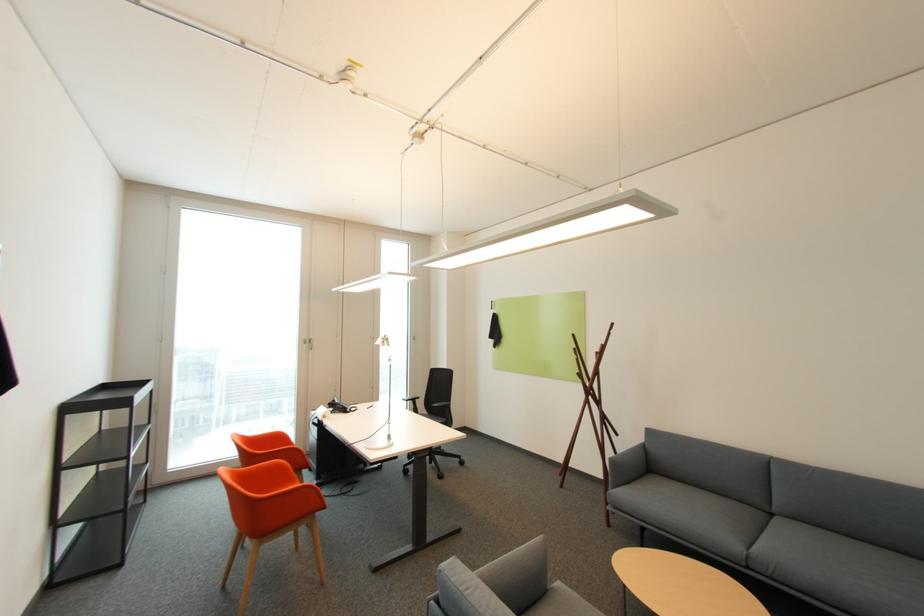
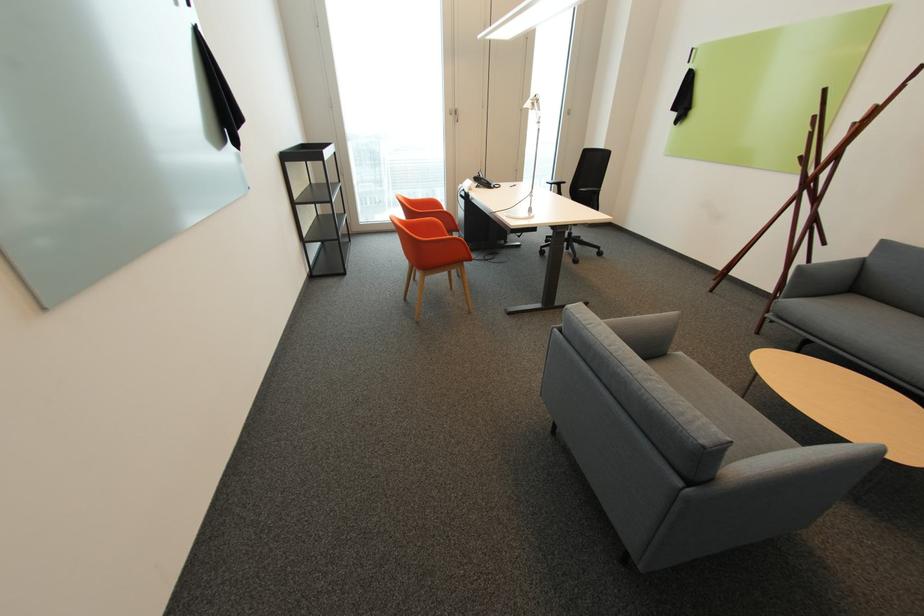
Find the pixel in the second image that matches (617,461) in the first image.

(806, 268)